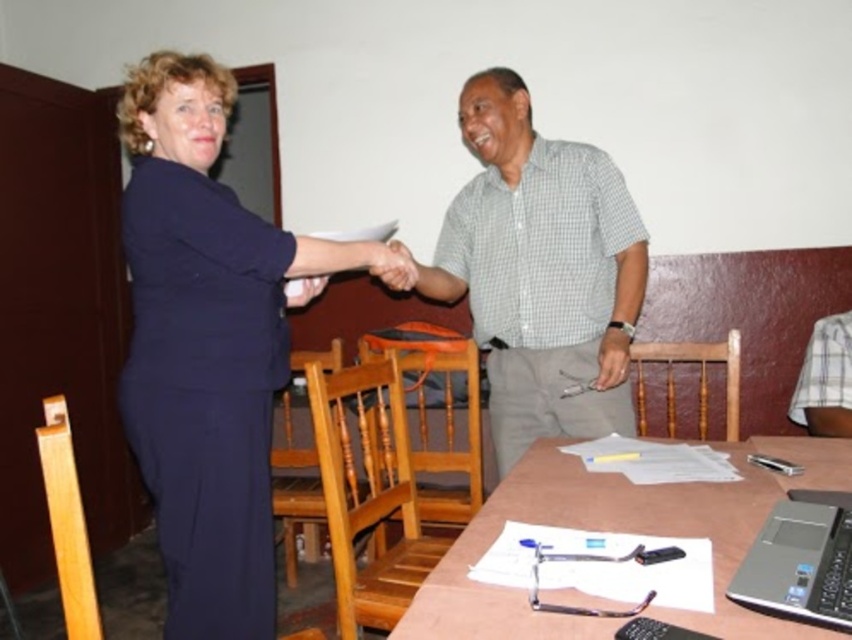
You are standing at the table and want to reach both the point at [717,612] and the point at [816,438]. Which point is closer to you?

Point at [717,612] is in front of point at [816,438], so it is closer to you.